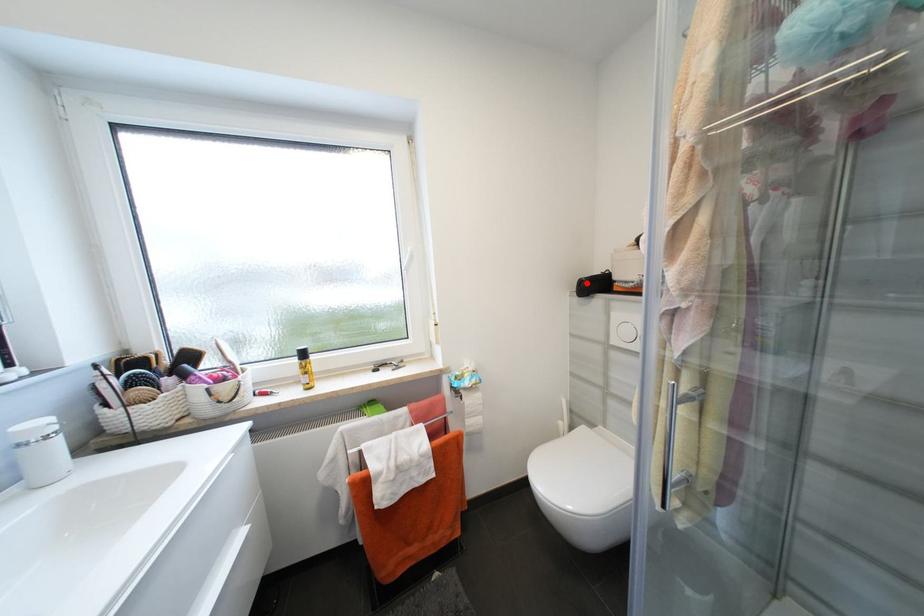
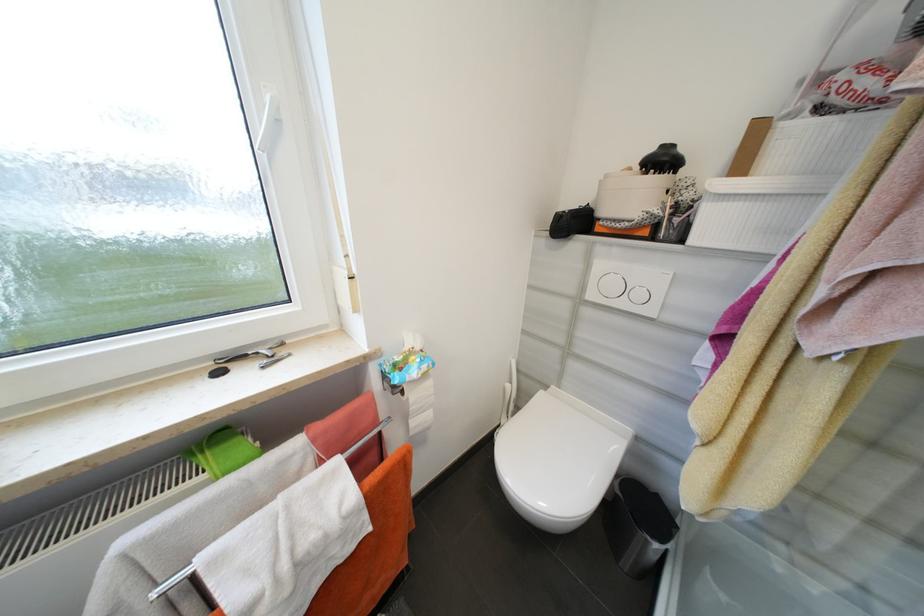
Question: I am providing you with two images of the same scene from different viewpoints. A red point is marked on the first image. Is the red point's position out of view in image 2?

Choices:
 (A) Yes
 (B) No

Answer: (B)